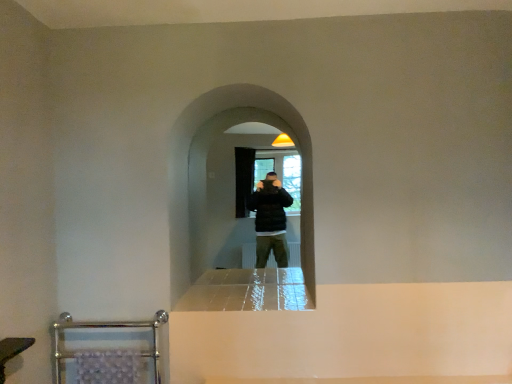
Measure the distance between point (81, 357) and camera.

7.30 feet.

The image size is (512, 384). I want to click on black matte screen door at center, so click(x=216, y=179).

Can you confirm if brushed metal towel rack at lower left is bigger than chrome metallic towel rack at lower left?

Incorrect, brushed metal towel rack at lower left is not larger than chrome metallic towel rack at lower left.

From the image's perspective, is brushed metal towel rack at lower left located above or below chrome metallic towel rack at lower left?

brushed metal towel rack at lower left is above chrome metallic towel rack at lower left.

From a real-world perspective, which object stands above the other?

From a 3D spatial view, brushed metal towel rack at lower left is above.

Can you confirm if brushed metal towel rack at lower left is wider than chrome metallic towel rack at lower left?

In fact, brushed metal towel rack at lower left might be narrower than chrome metallic towel rack at lower left.

Consider the image. Which object is further away from the camera, black matte screen door at center or brushed metal towel rack at lower left?

black matte screen door at center is further away from the camera.

Which is in front, point (201, 123) or point (28, 341)?

The point (28, 341) is closer.

Is black matte screen door at center at the left side of brushed metal towel rack at lower left?

No, black matte screen door at center is not to the left of brushed metal towel rack at lower left.

Is chrome metallic towel rack at lower left facing away from brushed metal towel rack at lower left?

chrome metallic towel rack at lower left does not have its back to brushed metal towel rack at lower left.

Identify the location of balustrade that is on the right side of brushed metal towel rack at lower left. The width and height of the screenshot is (512, 384). (106, 353).

Is chrome metallic towel rack at lower left directly adjacent to brushed metal towel rack at lower left?

chrome metallic towel rack at lower left and brushed metal towel rack at lower left are not in contact.

Does chrome metallic towel rack at lower left touch black matte screen door at center?

No, chrome metallic towel rack at lower left is not next to black matte screen door at center.

Based on the photo, who is more distant, chrome metallic towel rack at lower left or black matte screen door at center?

black matte screen door at center is behind.

Considering the relative positions of chrome metallic towel rack at lower left and black matte screen door at center in the image provided, is chrome metallic towel rack at lower left to the right of black matte screen door at center from the viewer's perspective?

In fact, chrome metallic towel rack at lower left is to the left of black matte screen door at center.

Does chrome metallic towel rack at lower left have a lesser height compared to black matte screen door at center?

Indeed, chrome metallic towel rack at lower left has a lesser height compared to black matte screen door at center.

Is brushed metal towel rack at lower left next to black matte screen door at center and touching it?

No, brushed metal towel rack at lower left is not beside black matte screen door at center.

From the image's perspective, is brushed metal towel rack at lower left located above black matte screen door at center?

Actually, brushed metal towel rack at lower left appears below black matte screen door at center in the image.

Does brushed metal towel rack at lower left have a lesser width compared to black matte screen door at center?

Yes.

From the picture: Does brushed metal towel rack at lower left have a smaller size compared to black matte screen door at center?

Correct, brushed metal towel rack at lower left occupies less space than black matte screen door at center.

You are a GUI agent. You are given a task and a screenshot of the screen. Output one action in this format:
    pyautogui.click(x=<x>, y=<y>)
    Task: Click on the balustrade located in front of the black matte screen door at center
    
    Given the screenshot: What is the action you would take?
    pyautogui.click(x=106, y=353)

In the scene shown: From a real-world perspective, is black matte screen door at center located beneath chrome metallic towel rack at lower left?

No.

Looking at this image, considering the sizes of black matte screen door at center and chrome metallic towel rack at lower left in the image, is black matte screen door at center taller or shorter than chrome metallic towel rack at lower left?

black matte screen door at center is taller than chrome metallic towel rack at lower left.

This screenshot has width=512, height=384. Find the location of `vanity that is on the left side of chrome metallic towel rack at lower left`. vanity that is on the left side of chrome metallic towel rack at lower left is located at coordinates (12, 351).

This screenshot has width=512, height=384. I want to click on screen door located above the brushed metal towel rack at lower left (from a real-world perspective), so click(216, 179).

When comparing their distances from black matte screen door at center, does brushed metal towel rack at lower left or chrome metallic towel rack at lower left seem further?

brushed metal towel rack at lower left lies further to black matte screen door at center than the other object.

From the image, which object appears to be nearer to brushed metal towel rack at lower left, black matte screen door at center or chrome metallic towel rack at lower left?

chrome metallic towel rack at lower left is positioned closer to the anchor brushed metal towel rack at lower left.

Looking at the image, which one is located further to black matte screen door at center, chrome metallic towel rack at lower left or brushed metal towel rack at lower left?

brushed metal towel rack at lower left.

From the image, which object appears to be farther from chrome metallic towel rack at lower left, black matte screen door at center or brushed metal towel rack at lower left?

Answer: black matte screen door at center is positioned further to the anchor chrome metallic towel rack at lower left.

Which object lies nearer to the anchor point chrome metallic towel rack at lower left, brushed metal towel rack at lower left or black matte screen door at center?

brushed metal towel rack at lower left is positioned closer to the anchor chrome metallic towel rack at lower left.

Based on their spatial positions, is chrome metallic towel rack at lower left or black matte screen door at center further from brushed metal towel rack at lower left?

black matte screen door at center is further to brushed metal towel rack at lower left.

Where is `balustrade situated between brushed metal towel rack at lower left and black matte screen door at center from left to right`? The height and width of the screenshot is (384, 512). balustrade situated between brushed metal towel rack at lower left and black matte screen door at center from left to right is located at coordinates 106,353.